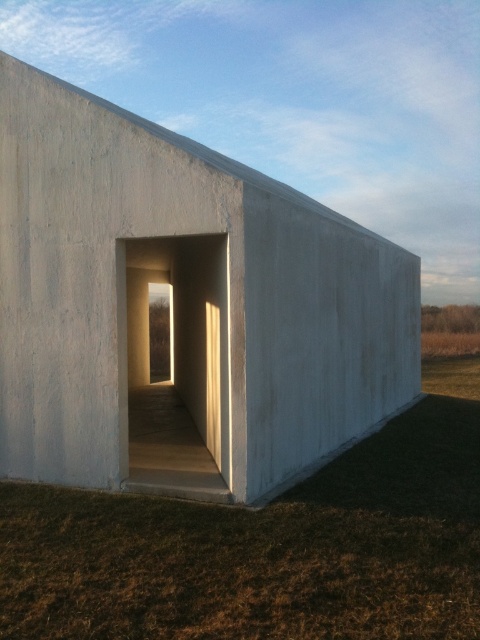
Question: Is white concrete wall at center to the right of brown grass at lower center from the viewer's perspective?

Choices:
 (A) yes
 (B) no

Answer: (B)

Question: Which point appears closest to the camera in this image?

Choices:
 (A) (120, 253)
 (B) (469, 611)

Answer: (B)

Question: Is white concrete wall at center to the right of brown grass at lower center from the viewer's perspective?

Choices:
 (A) yes
 (B) no

Answer: (B)

Question: Is white concrete wall at center bigger than brown grass at lower center?

Choices:
 (A) no
 (B) yes

Answer: (B)